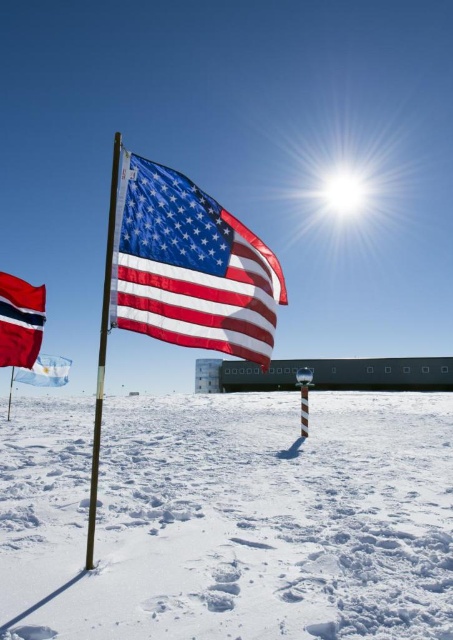
Question: Is white fluffy snow at center smaller than blue fabric flag at center?

Choices:
 (A) no
 (B) yes

Answer: (A)

Question: Based on their relative distances, which object is nearer to the blue fabric flag at center?

Choices:
 (A) red fabric flag at lower left
 (B) metallic silver flag pole at center

Answer: (A)

Question: Does matte fabric flag at center have a lesser width compared to blue fabric flag at center?

Choices:
 (A) no
 (B) yes

Answer: (A)

Question: Which object is positioned closest to the matte fabric flag at center?

Choices:
 (A) metallic silver flag pole at center
 (B) red fabric flag at lower left
 (C) white fluffy snow at center

Answer: (A)

Question: Does red fabric flag at lower left come behind blue fabric flag at center?

Choices:
 (A) yes
 (B) no

Answer: (B)

Question: Which object is positioned farthest from the blue fabric flag at center?

Choices:
 (A) matte fabric flag at center
 (B) white fluffy snow at center
 (C) red fabric flag at lower left

Answer: (A)